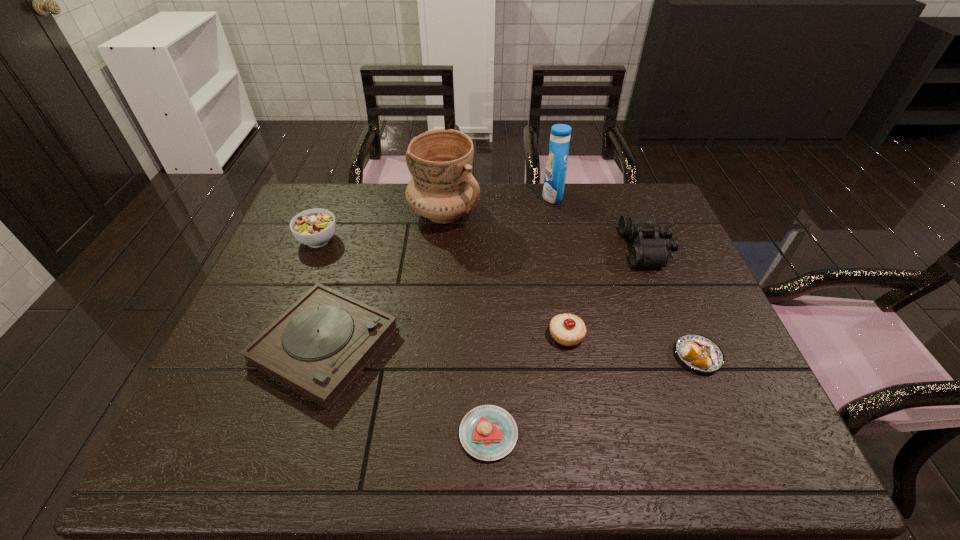
Where is `free region located 0.200m on the front-facing side of the detergent`? free region located 0.200m on the front-facing side of the detergent is located at coordinates (484, 196).

You are a GUI agent. You are given a task and a screenshot of the screen. Output one action in this format:
    pyautogui.click(x=<x>, y=<y>)
    Task: Click on the vacant area situated on the front of the pottery
    The image size is (960, 540).
    Given the screenshot: What is the action you would take?
    pyautogui.click(x=435, y=307)

Locate an element on the screen. The image size is (960, 540). vacant space located 0.400m at the eyepieces of the binoculars is located at coordinates (491, 248).

Image resolution: width=960 pixels, height=540 pixels. Identify the location of vacant space situated 0.290m at the eyepieces of the binoculars. (528, 248).

At what (x,y) coordinates should I click in order to perform the action: click on free spot located at the eyepieces of the binoculars. Please return your answer as a coordinate pair (x, y). This screenshot has width=960, height=540. Looking at the image, I should click on (515, 248).

The height and width of the screenshot is (540, 960). I want to click on free space located on the front of the soup bowl, so [x=294, y=302].

Where is `free space located 0.070m on the right of the tallest pastry`? The image size is (960, 540). free space located 0.070m on the right of the tallest pastry is located at coordinates pyautogui.click(x=612, y=335).

Identify the location of vacant area located 0.180m on the right of the sixth tallest object. This screenshot has height=540, width=960. (470, 345).

This screenshot has width=960, height=540. I want to click on free space located 0.320m on the back of the rightmost pastry, so click(654, 251).

At what (x,y) coordinates should I click in order to perform the action: click on free space located 0.350m on the left of the leftmost pastry. Please return your answer as a coordinate pair (x, y). The image size is (960, 540). Looking at the image, I should click on (289, 434).